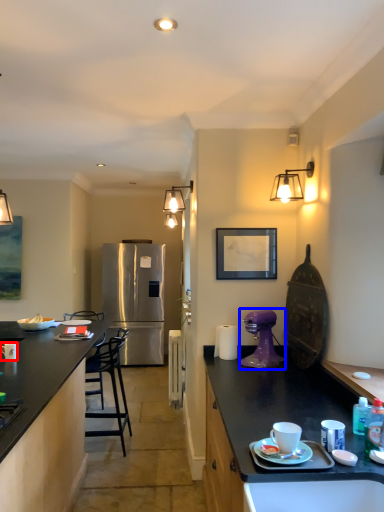
Question: Which object is further to the camera taking this photo, coffee cup (highlighted by a red box) or coffee maker (highlighted by a blue box)?

Choices:
 (A) coffee cup
 (B) coffee maker

Answer: (A)